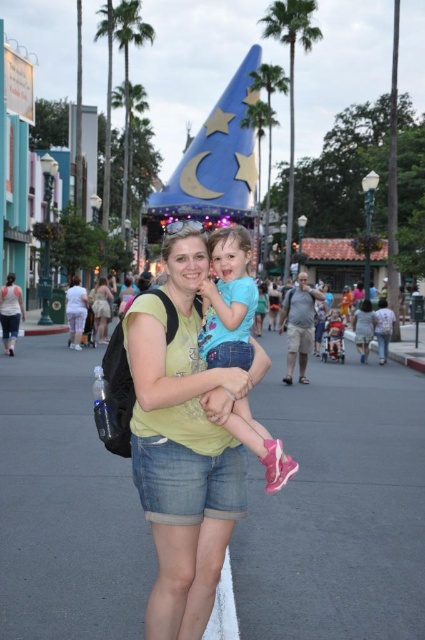
Question: Which of the following is the farthest from the observer?

Choices:
 (A) (232, 362)
 (B) (215, 452)
 (C) (76, 308)
 (D) (108, 307)

Answer: (D)

Question: Does denim shorts at center have a lesser width compared to matte black backpack at center?

Choices:
 (A) no
 (B) yes

Answer: (A)

Question: Does denim shorts at center lie in front of green leafy palm tree at upper center?

Choices:
 (A) no
 (B) yes

Answer: (B)

Question: Does blue denim shorts at center have a larger size compared to white cotton tank top at lower left?

Choices:
 (A) yes
 (B) no

Answer: (A)

Question: Which of these objects is positioned farthest from the light pink cotton pants at center?

Choices:
 (A) white cotton tank top at lower left
 (B) yellow matte arm at center
 (C) denim shorts at center

Answer: (B)

Question: Which object is the farthest from the white cotton tank top at lower left?

Choices:
 (A) matte black backpack at center
 (B) green leafy palm tree at upper center

Answer: (B)